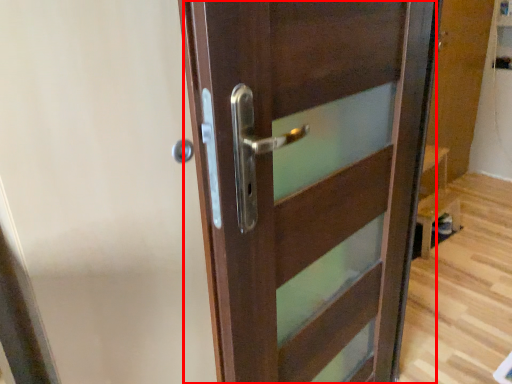
Question: Observing the image, what is the correct spatial positioning of door (annotated by the red box) in reference to screen door?

Choices:
 (A) right
 (B) left

Answer: (A)